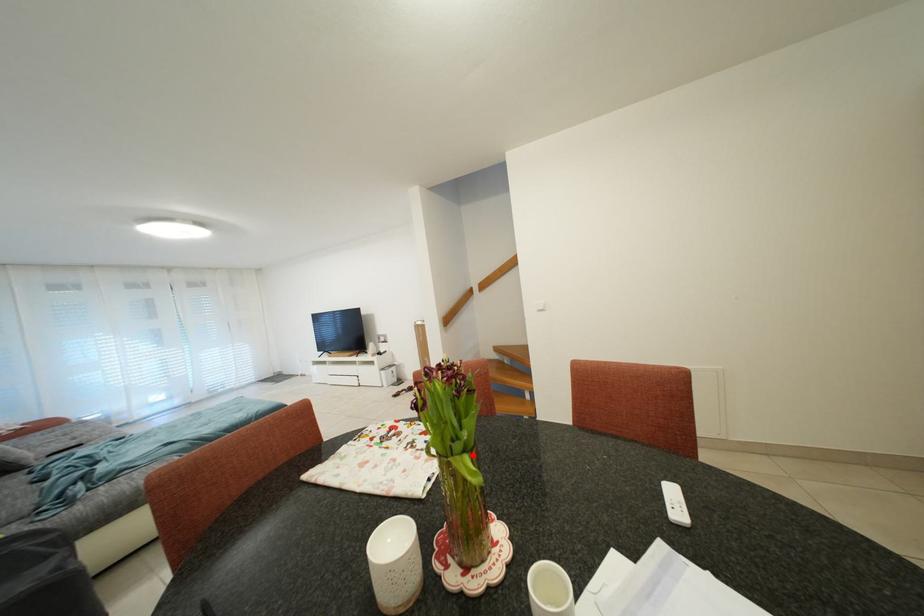
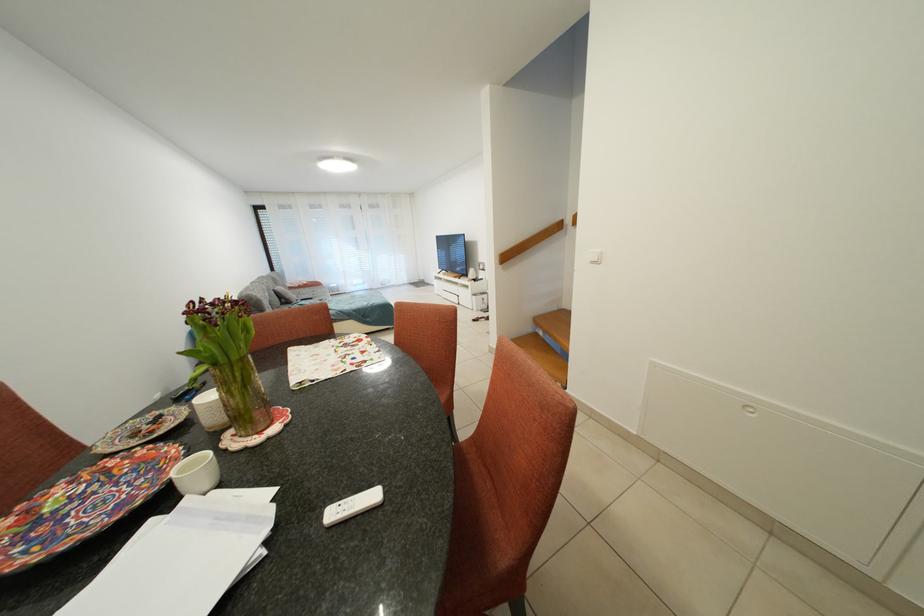
Locate, in the second image, the point that corresponds to the highlighted location in the first image.

(223, 369)